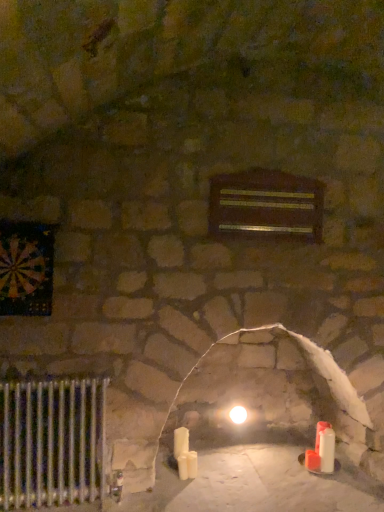
Image resolution: width=384 pixels, height=512 pixels. Identify the location of empty space that is ontop of wooden plaque at center. (289, 167).